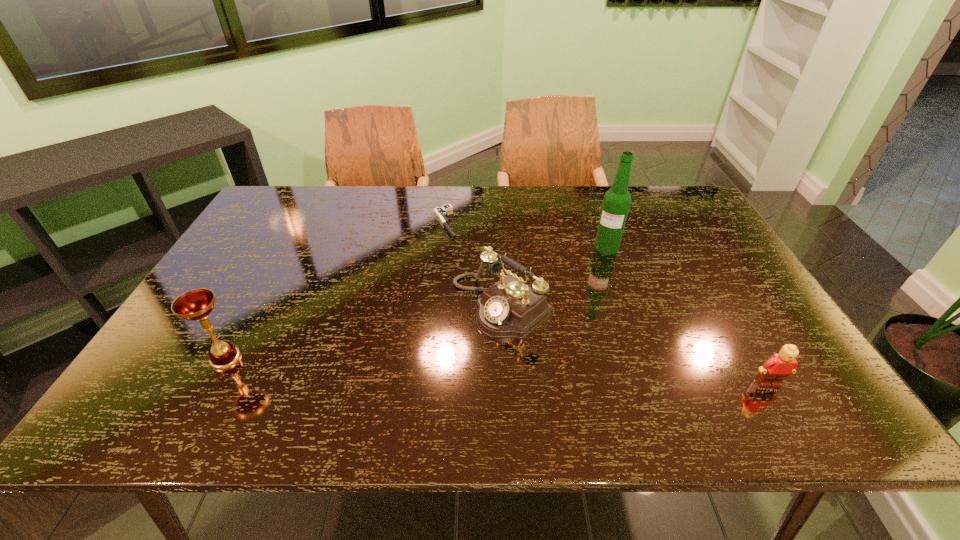
At what (x,y) coordinates should I click in order to perform the action: click on chalice located in the near edge section of the desktop. Please return your answer as a coordinate pair (x, y). Looking at the image, I should click on (197, 304).

I want to click on Lego positioned at the near edge, so click(780, 365).

This screenshot has height=540, width=960. I want to click on object that is at the left edge, so click(x=197, y=304).

The image size is (960, 540). I want to click on object at the right edge, so click(780, 365).

Identify the location of object present at the near left corner. (197, 304).

At what (x,y) coordinates should I click in order to perform the action: click on object that is positioned at the near right corner. Please return your answer as a coordinate pair (x, y). The image size is (960, 540). Looking at the image, I should click on (780, 365).

Image resolution: width=960 pixels, height=540 pixels. I want to click on free space at the far edge of the desktop, so click(414, 190).

Identify the location of free space at the near edge. (222, 375).

In the image, there is a desktop. Where is `vacant space at the left edge`? The width and height of the screenshot is (960, 540). vacant space at the left edge is located at coordinates (270, 281).

Image resolution: width=960 pixels, height=540 pixels. Find the location of `vacant space at the right edge`. vacant space at the right edge is located at coordinates (732, 338).